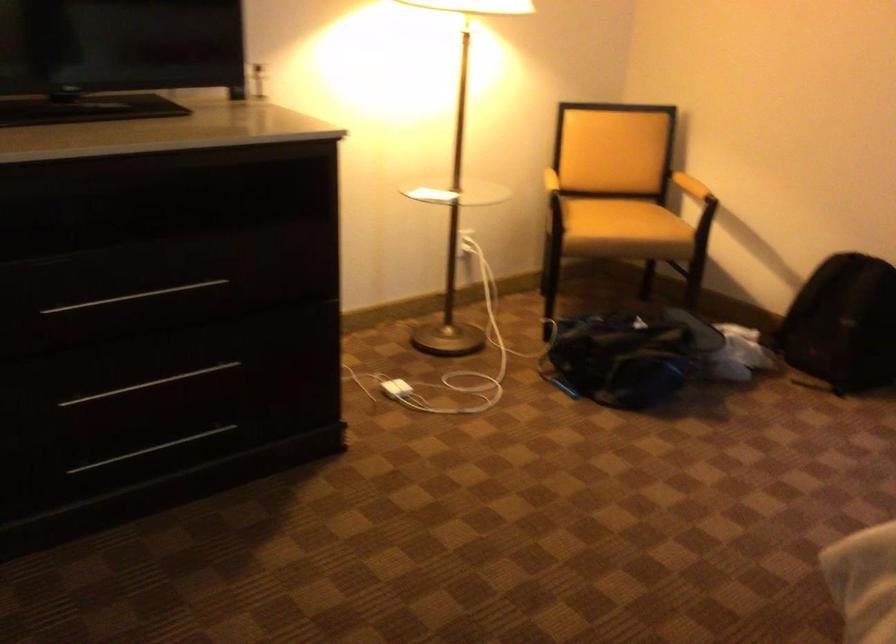
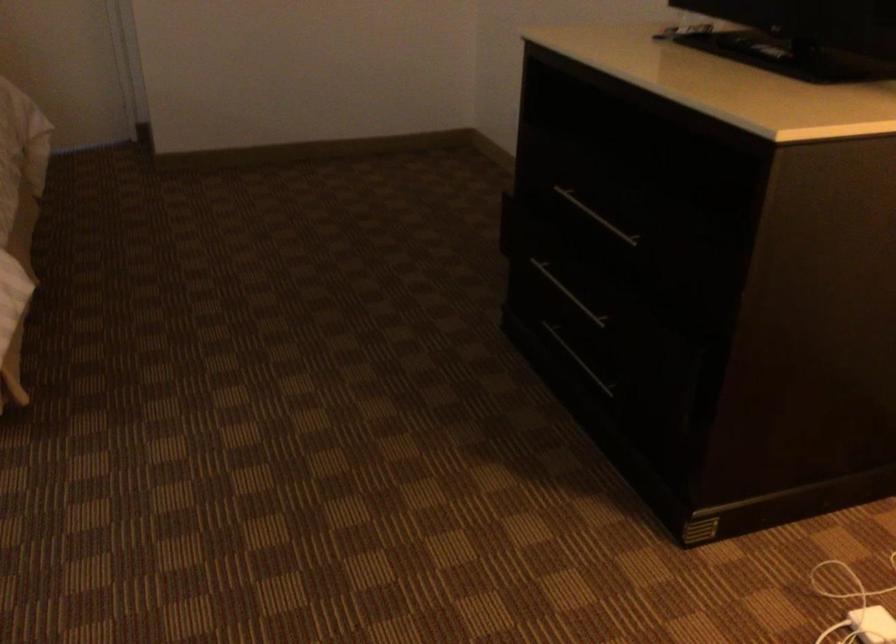
Locate, in the second image, the point that corresponds to (x=138, y=459) in the first image.

(579, 360)